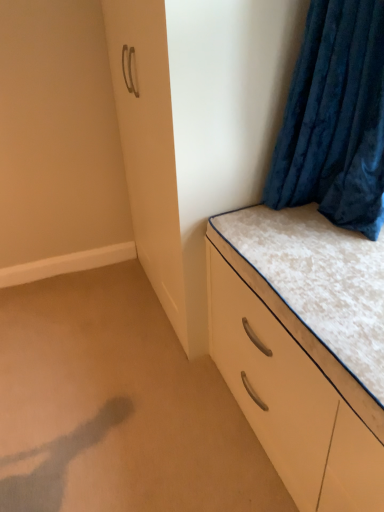
Question: Considering the relative sizes of white glossy chest of drawers at lower right and velvet blue curtain at upper right in the image provided, is white glossy chest of drawers at lower right wider than velvet blue curtain at upper right?

Choices:
 (A) yes
 (B) no

Answer: (A)

Question: Does white glossy chest of drawers at lower right come behind velvet blue curtain at upper right?

Choices:
 (A) yes
 (B) no

Answer: (B)

Question: Is white glossy chest of drawers at lower right bigger than velvet blue curtain at upper right?

Choices:
 (A) no
 (B) yes

Answer: (B)

Question: Does white glossy chest of drawers at lower right have a smaller size compared to velvet blue curtain at upper right?

Choices:
 (A) yes
 (B) no

Answer: (B)

Question: Considering the relative sizes of white glossy chest of drawers at lower right and velvet blue curtain at upper right in the image provided, is white glossy chest of drawers at lower right taller than velvet blue curtain at upper right?

Choices:
 (A) no
 (B) yes

Answer: (A)

Question: Considering the positions of velvet blue curtain at upper right and beige carpet at lower left in the image, is velvet blue curtain at upper right wider or thinner than beige carpet at lower left?

Choices:
 (A) thin
 (B) wide

Answer: (A)

Question: From their relative heights in the image, would you say velvet blue curtain at upper right is taller or shorter than beige carpet at lower left?

Choices:
 (A) tall
 (B) short

Answer: (A)

Question: Visually, is velvet blue curtain at upper right positioned to the left or to the right of beige carpet at lower left?

Choices:
 (A) right
 (B) left

Answer: (A)

Question: From the image's perspective, is velvet blue curtain at upper right positioned above or below beige carpet at lower left?

Choices:
 (A) above
 (B) below

Answer: (A)

Question: Is point (312, 376) positioned closer to the camera than point (19, 416)?

Choices:
 (A) farther
 (B) closer

Answer: (B)

Question: Would you say white glossy chest of drawers at lower right is to the left or to the right of beige carpet at lower left in the picture?

Choices:
 (A) right
 (B) left

Answer: (A)

Question: From a real-world perspective, relative to beige carpet at lower left, is white glossy chest of drawers at lower right vertically above or below?

Choices:
 (A) above
 (B) below

Answer: (A)

Question: In terms of width, does white glossy chest of drawers at lower right look wider or thinner when compared to beige carpet at lower left?

Choices:
 (A) wide
 (B) thin

Answer: (B)

Question: Is beige carpet at lower left inside the boundaries of white glossy chest of drawers at lower right, or outside?

Choices:
 (A) outside
 (B) inside

Answer: (A)

Question: From the image's perspective, is beige carpet at lower left above or below white glossy chest of drawers at lower right?

Choices:
 (A) below
 (B) above

Answer: (A)